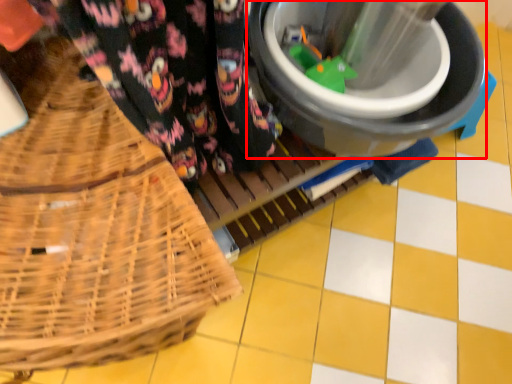
Question: Observing the image, what is the correct spatial positioning of appliance (annotated by the red box) in reference to picnic basket?

Choices:
 (A) right
 (B) left

Answer: (A)